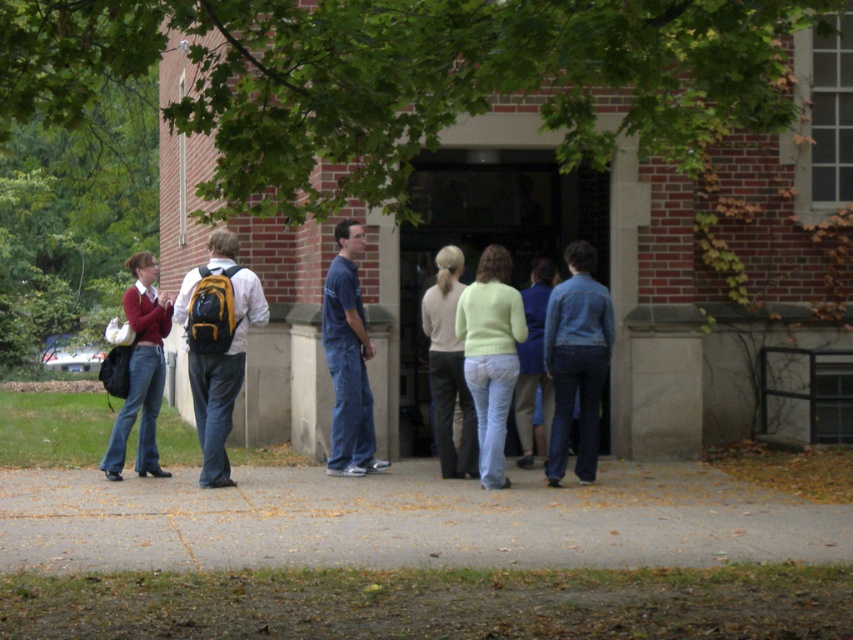
Question: Which object is farther from the camera taking this photo?

Choices:
 (A) gray concrete pavement at lower center
 (B) green leafy tree at upper center
 (C) light green sweater at center

Answer: (C)

Question: Which object is positioned closest to the matte black backpack at left?

Choices:
 (A) light green sweater at center
 (B) green leafy tree at upper center

Answer: (A)

Question: Does light green sweater at center have a smaller size compared to matte black backpack at left?

Choices:
 (A) no
 (B) yes

Answer: (A)

Question: Which of the following is the closest to the observer?

Choices:
 (A) (120, 445)
 (B) (479, 294)

Answer: (B)

Question: Considering the relative positions of green leafy tree at upper center and gray concrete pavement at lower center in the image provided, where is green leafy tree at upper center located with respect to gray concrete pavement at lower center?

Choices:
 (A) left
 (B) right

Answer: (A)

Question: Is green leafy tree at upper center in front of light green sweater at center?

Choices:
 (A) no
 (B) yes

Answer: (B)